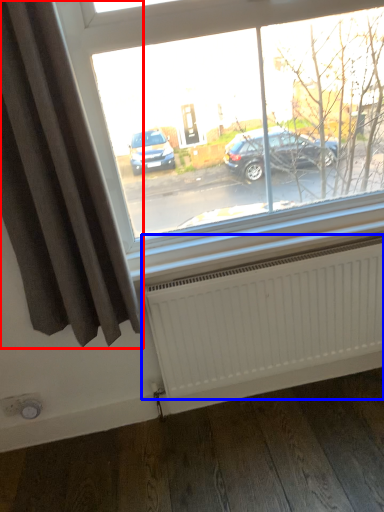
Question: Which of the following is the farthest to the observer, curtain (highlighted by a red box) or radiator (highlighted by a blue box)?

Choices:
 (A) curtain
 (B) radiator

Answer: (B)